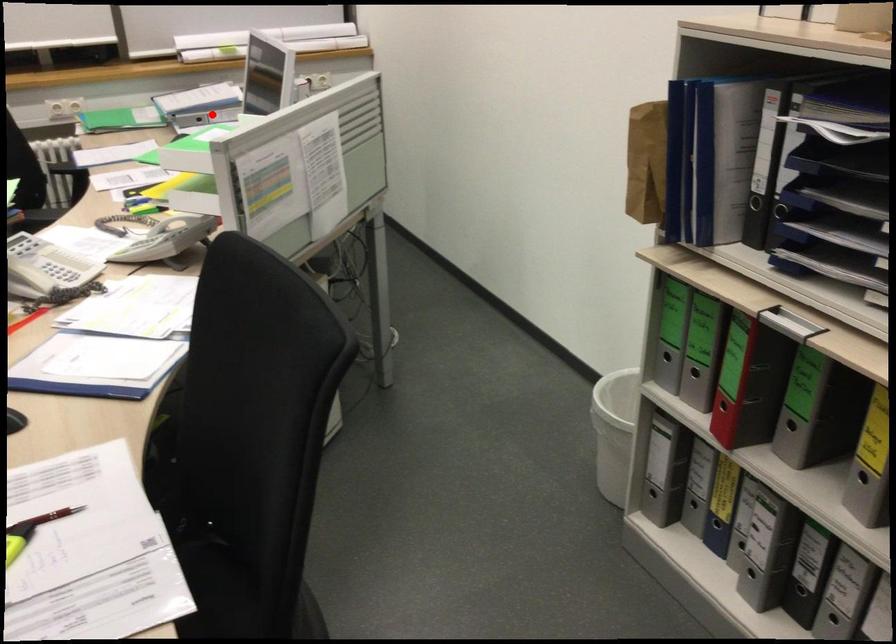
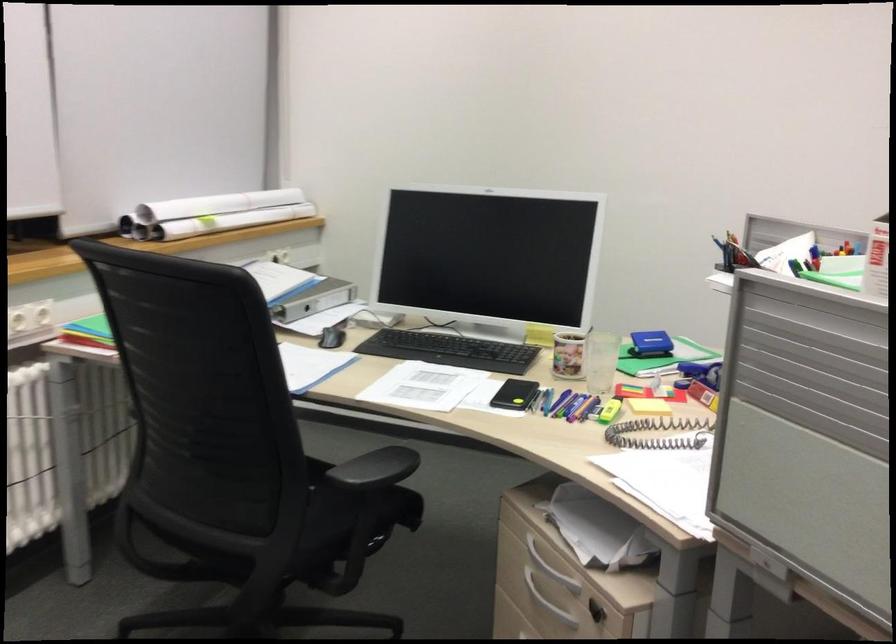
Question: A red point is marked in image1. In image2, is the corresponding 3D point closer to the camera or farther? Reply with the corresponding letter.

Choices:
 (A) The corresponding 3D point is closer.
 (B) The corresponding 3D point is farther.

Answer: (A)